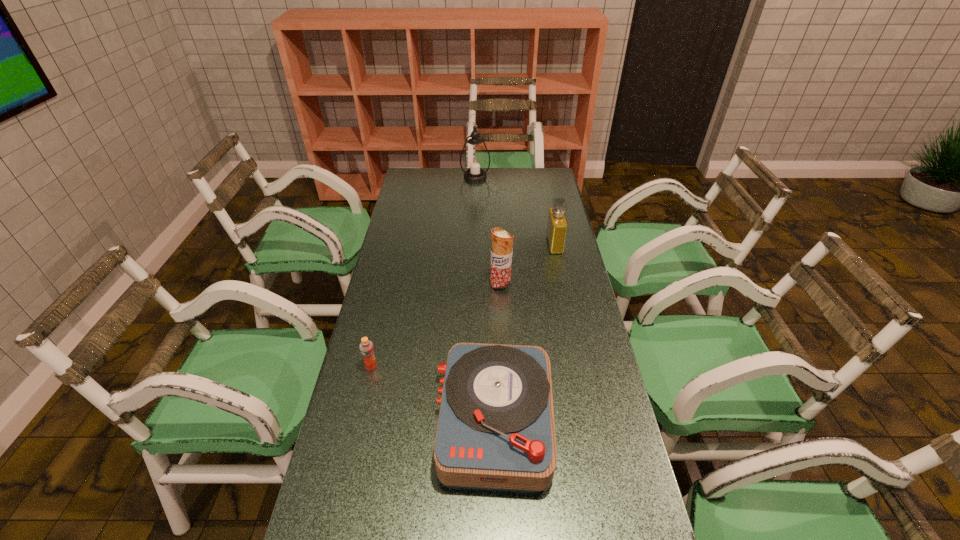
Where is `blank space at the right edge of the desktop`? Image resolution: width=960 pixels, height=540 pixels. blank space at the right edge of the desktop is located at coordinates (537, 196).

The image size is (960, 540). In the image, there is a desktop. What are the coordinates of `vacant space at the far left corner` in the screenshot? It's located at (413, 182).

Where is `vacant area that lies between the third tallest object and the orange juice`? The image size is (960, 540). vacant area that lies between the third tallest object and the orange juice is located at coordinates (463, 306).

I want to click on empty space that is in between the farthest object and the leftmost object, so click(423, 272).

The height and width of the screenshot is (540, 960). In order to click on free area in between the record player and the farthest object in this screenshot , I will do `click(485, 299)`.

You are a GUI agent. You are given a task and a screenshot of the screen. Output one action in this format:
    pyautogui.click(x=<x>, y=<y>)
    Task: Click on the empty space that is in between the second tallest object and the perfume
    Image resolution: width=960 pixels, height=540 pixels.
    Given the screenshot: What is the action you would take?
    pyautogui.click(x=527, y=265)

You are a GUI agent. You are given a task and a screenshot of the screen. Output one action in this format:
    pyautogui.click(x=<x>, y=<y>)
    Task: Click on the vacant area that lies between the second tallest object and the farthest object
    
    Given the screenshot: What is the action you would take?
    pyautogui.click(x=488, y=231)

The height and width of the screenshot is (540, 960). Find the location of `unoccupied position between the rightmost object and the second tallest object`. unoccupied position between the rightmost object and the second tallest object is located at coordinates (527, 265).

Locate an element on the screen. This screenshot has height=540, width=960. free space between the oil lamp and the orange juice is located at coordinates (423, 272).

Find the location of a particular element. Image resolution: width=960 pixels, height=540 pixels. vacant area between the third tallest object and the leftmost object is located at coordinates (463, 306).